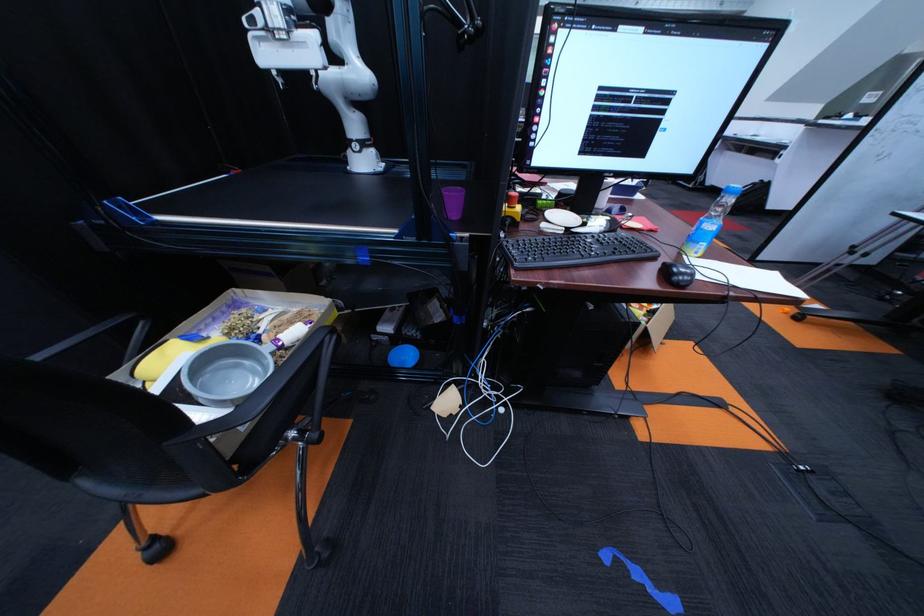
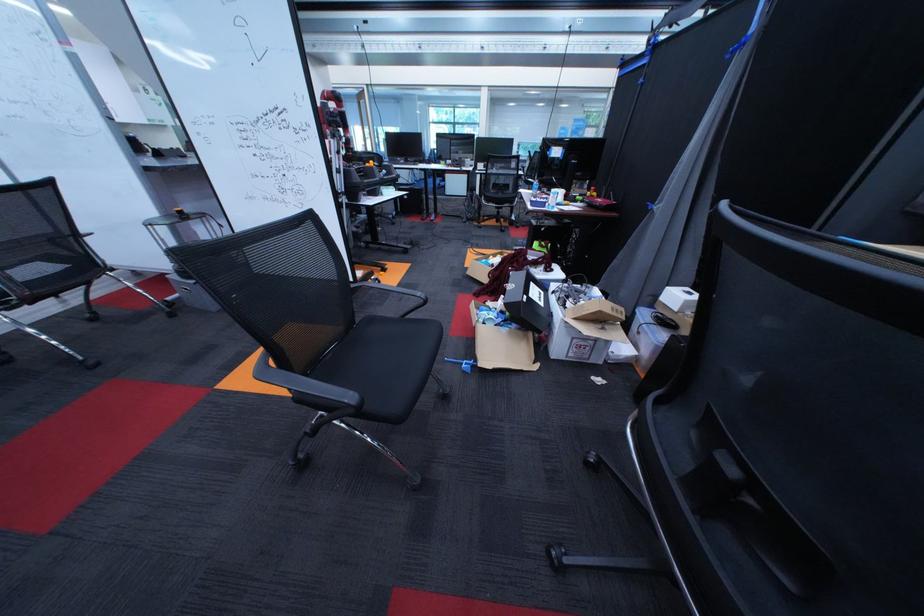
Question: I am providing you with two images of the same scene from different viewpoints. Please identify which objects are invisible in image2.

Choices:
 (A) black computer mouse
 (B) cardboard box
 (C) black dumbbell handle
 (D) white box

Answer: (A)